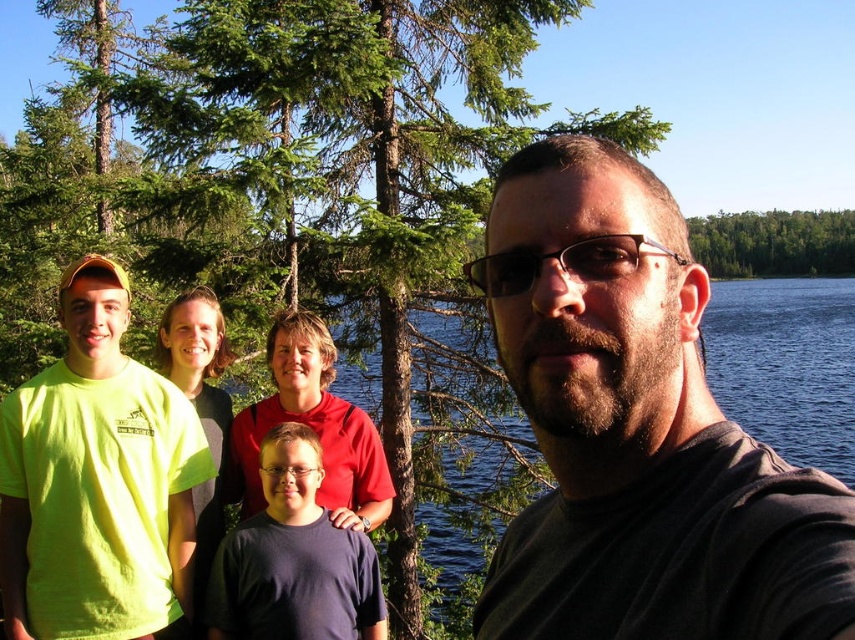
Who is positioned more to the left, dark gray t-shirt at center or dark blue t-shirt at center?

Positioned to the left is dark blue t-shirt at center.

Does dark gray t-shirt at center appear on the right side of dark blue t-shirt at center?

Correct, you'll find dark gray t-shirt at center to the right of dark blue t-shirt at center.

Is point (517, 205) positioned in front of point (236, 545)?

Yes, it is in front of point (236, 545).

Locate an element on the screen. dark gray t-shirt at center is located at coordinates (637, 429).

Does neon yellow t-shirt at left appear under dark blue t-shirt at center?

No.

Who is higher up, neon yellow t-shirt at left or dark blue t-shirt at center?

neon yellow t-shirt at left is above.

Locate an element on the screen. The image size is (855, 640). neon yellow t-shirt at left is located at coordinates (98, 481).

Is dark gray t-shirt at center thinner than neon yellow t-shirt at left?

Correct, dark gray t-shirt at center's width is less than neon yellow t-shirt at left's.

Can you confirm if dark gray t-shirt at center is positioned below neon yellow t-shirt at left?

No, dark gray t-shirt at center is not below neon yellow t-shirt at left.

Is point (555, 353) in front of point (98, 333)?

Yes, point (555, 353) is in front of point (98, 333).

Where is `dark gray t-shirt at center`? This screenshot has width=855, height=640. dark gray t-shirt at center is located at coordinates (637, 429).